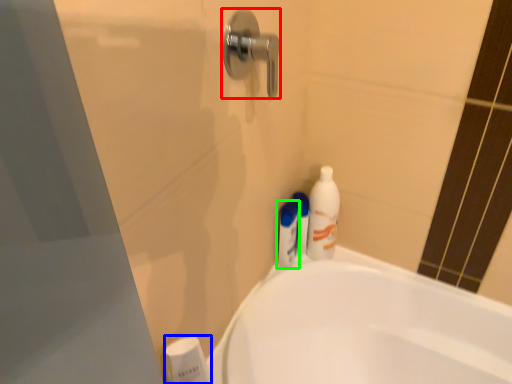
Question: Based on their relative distances, which object is nearer to door handle (highlighted by a red box)? Choose from toiletry (highlighted by a blue box) and toiletry (highlighted by a green box).

Choices:
 (A) toiletry
 (B) toiletry

Answer: (B)